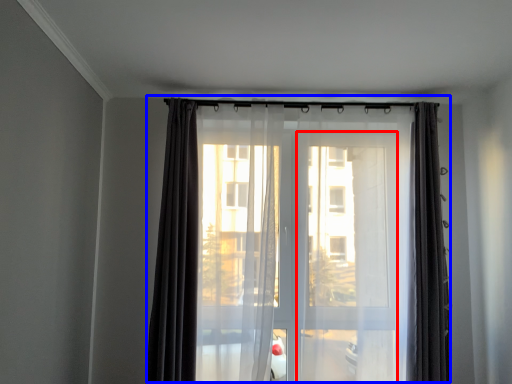
Question: Which of the following is the farthest to the observer, screen door (highlighted by a red box) or curtain (highlighted by a blue box)?

Choices:
 (A) screen door
 (B) curtain

Answer: (B)